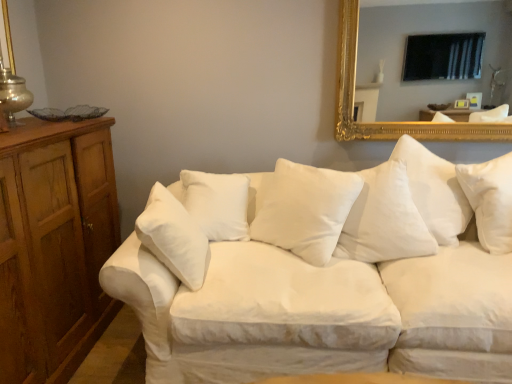
Question: Would you consider white soft cushion at center to be distant from white cotton couch at center?

Choices:
 (A) no
 (B) yes

Answer: (A)

Question: Is white soft cushion at center at the right side of white cotton couch at center?

Choices:
 (A) no
 (B) yes

Answer: (A)

Question: Is white soft cushion at center oriented away from white cotton couch at center?

Choices:
 (A) yes
 (B) no

Answer: (A)

Question: Does white soft cushion at center have a smaller size compared to white cotton couch at center?

Choices:
 (A) no
 (B) yes

Answer: (B)

Question: Does white soft cushion at center have a greater height compared to white cotton couch at center?

Choices:
 (A) no
 (B) yes

Answer: (A)

Question: From a real-world perspective, is white soft cushion at center located higher than white cotton couch at center?

Choices:
 (A) yes
 (B) no

Answer: (A)

Question: Is white soft cushion at center positioned with its back to gold-framed mirror at upper right?

Choices:
 (A) yes
 (B) no

Answer: (B)

Question: Considering the relative sizes of white soft cushion at center and gold-framed mirror at upper right in the image provided, is white soft cushion at center smaller than gold-framed mirror at upper right?

Choices:
 (A) yes
 (B) no

Answer: (B)

Question: From a real-world perspective, is white soft cushion at center physically below gold-framed mirror at upper right?

Choices:
 (A) no
 (B) yes

Answer: (B)

Question: Considering the relative sizes of white soft cushion at center and gold-framed mirror at upper right in the image provided, is white soft cushion at center wider than gold-framed mirror at upper right?

Choices:
 (A) yes
 (B) no

Answer: (A)

Question: Is white soft cushion at center facing towards gold-framed mirror at upper right?

Choices:
 (A) yes
 (B) no

Answer: (B)

Question: Are white soft cushion at center and gold-framed mirror at upper right making contact?

Choices:
 (A) no
 (B) yes

Answer: (A)

Question: Is gold-framed mirror at upper right facing away from white cotton couch at center?

Choices:
 (A) no
 (B) yes

Answer: (A)